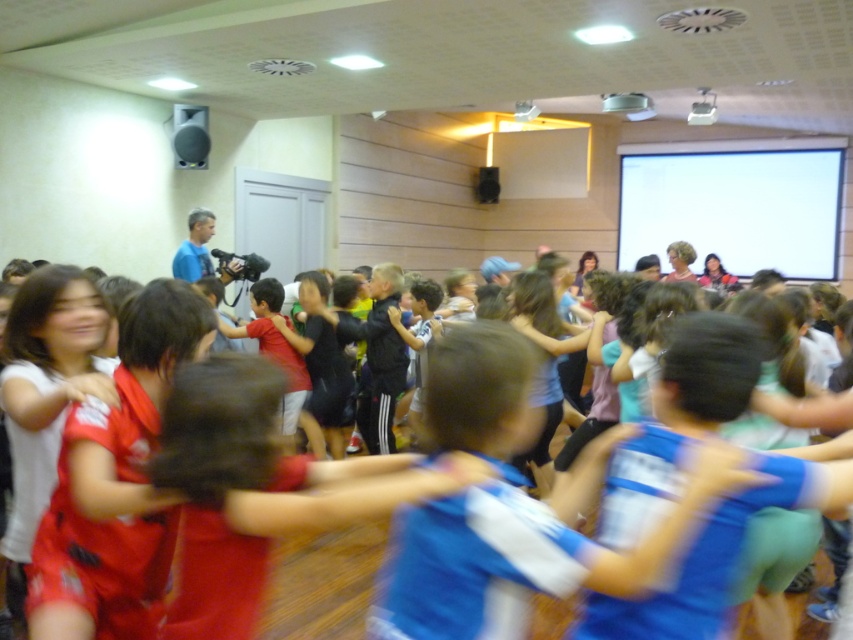
Which is above, white matte projection screen at upper right or metallic projector at upper center?

metallic projector at upper center is above.

Who is shorter, white matte projection screen at upper right or metallic projector at upper center?

With less height is metallic projector at upper center.

I want to click on white matte projection screen at upper right, so click(x=735, y=209).

Between matte black speaker at upper left and metallic projector at upper center, which one has more height?

matte black speaker at upper left

Who is positioned more to the left, matte black speaker at upper left or metallic projector at upper center?

Positioned to the left is matte black speaker at upper left.

Find the location of a particular element. Image resolution: width=853 pixels, height=640 pixels. matte black speaker at upper left is located at coordinates (190, 134).

Does point (764, 148) come in front of point (202, 141)?

That is False.

Is white matte projection screen at upper right shorter than matte black speaker at upper left?

No, white matte projection screen at upper right is not shorter than matte black speaker at upper left.

Who is more forward, (x=753, y=196) or (x=201, y=140)?

Point (x=201, y=140)

Identify the location of white matte projection screen at upper right. coord(735,209).